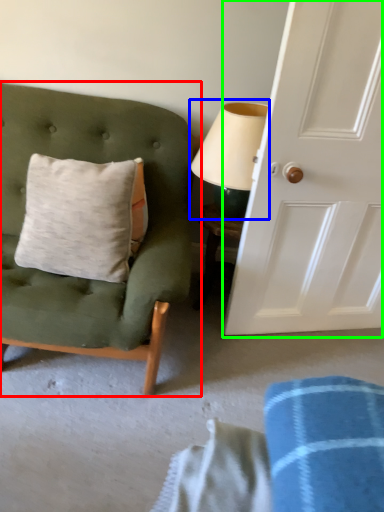
Question: Considering the real-world distances, which object is farthest from chair (highlighted by a red box)? table lamp (highlighted by a blue box) or door (highlighted by a green box)?

Choices:
 (A) table lamp
 (B) door

Answer: (B)